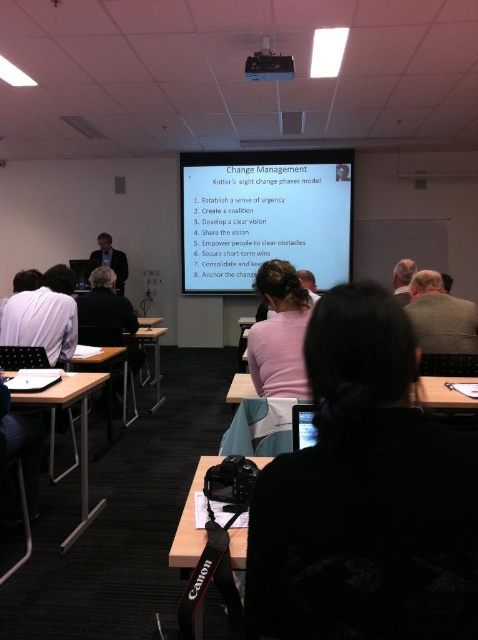
How far apart are metallic silver table at center and gray hair at upper right?

metallic silver table at center and gray hair at upper right are 7.25 feet apart.

Which is more to the right, metallic silver table at center or gray hair at upper right?

gray hair at upper right

This screenshot has height=640, width=478. Describe the element at coordinates (153, 356) in the screenshot. I see `metallic silver table at center` at that location.

You are a GUI agent. You are given a task and a screenshot of the screen. Output one action in this format:
    pyautogui.click(x=<x>, y=<y>)
    Task: Click on the metallic silver table at center
    
    Given the screenshot: What is the action you would take?
    click(x=153, y=356)

Image resolution: width=478 pixels, height=640 pixels. What do you see at coordinates (280, 333) in the screenshot? I see `pink fabric shirt at center` at bounding box center [280, 333].

Between point (292, 387) and point (83, 509), which one is positioned in front?

Point (292, 387)

At what (x,y) coordinates should I click in order to perform the action: click on pink fabric shirt at center. Please return your answer as a coordinate pair (x, y). This screenshot has width=478, height=640. Looking at the image, I should click on (280, 333).

The width and height of the screenshot is (478, 640). I want to click on pink fabric shirt at center, so click(x=280, y=333).

Does black fabric chair at lower left have a greater height compared to gray hair at upper right?

Indeed, black fabric chair at lower left has a greater height compared to gray hair at upper right.

Is black fabric chair at lower left shorter than gray hair at upper right?

Incorrect, black fabric chair at lower left's height does not fall short of gray hair at upper right's.

Who is more distant from viewer, (115, 273) or (403, 296)?

Positioned behind is point (115, 273).

Identify the location of black fabric chair at lower left. The height and width of the screenshot is (640, 478). [x=105, y=310].